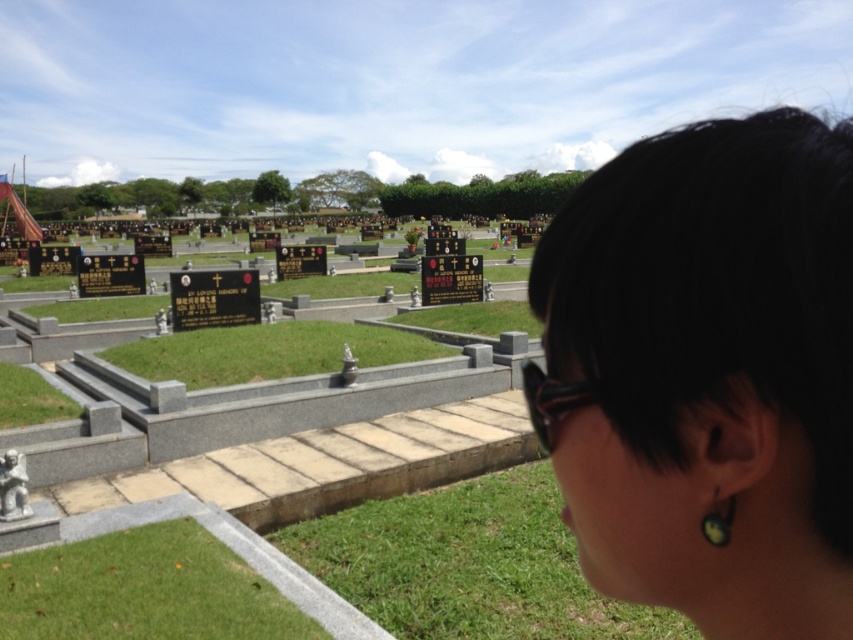
You are a photographer trying to capture the person in the cemetery. You want to ensure that both the black hair at upper right and the green matte earring at lower right are visible in the frame. Based on their positions, which object should you focus on first to ensure both are in the shot?

The black hair at upper right is located above the green matte earring at lower right. To ensure both are in the frame, focus on the black hair at upper right first, as it is higher up, and adjust the camera angle downward to include the green matte earring at lower right.

From the picture: You are a photographer trying to capture the scene of the cemetery. You notice the black hair at upper right and the green matte earring at lower right. Which object would appear larger in your photo?

The black hair at upper right would appear larger in the photo since it is bigger than the green matte earring at lower right.

You are a photographer trying to capture the person in the cemetery scene. You notice the black hair at upper right and the green matte earring at lower right. Which object should you focus on first to ensure it appears sharp in the photo?

You should focus on the black hair at upper right first because it is in front of the green matte earring at lower right, so focusing on the closer object will ensure it appears sharp while the background may blur slightly.